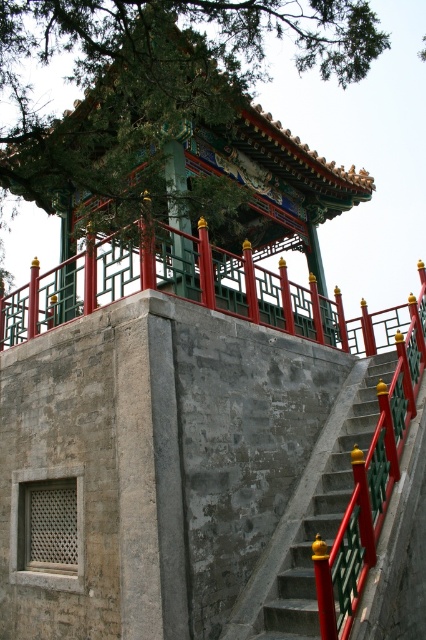
Between point (328, 525) and point (170, 173), which one is positioned in front?

Point (328, 525) is in front.

In the scene shown: Is concrete stairs at center smaller than green painted wood pillar at center?

Actually, concrete stairs at center might be larger than green painted wood pillar at center.

Is point (313, 582) farther from viewer compared to point (169, 177)?

No, (313, 582) is in front of (169, 177).

I want to click on concrete stairs at center, so click(310, 516).

Does green textured tree at upper center appear on the left side of green painted wood pillar at center?

No, green textured tree at upper center is not to the left of green painted wood pillar at center.

Does green textured tree at upper center appear under green painted wood pillar at center?

No.

Who is more distant from viewer, (31, 160) or (183, 285)?

The point (183, 285) is more distant.

Image resolution: width=426 pixels, height=640 pixels. I want to click on green textured tree at upper center, so click(154, 77).

Between green textured tree at upper center and concrete stairs at center, which one has more height?

→ green textured tree at upper center is taller.

Describe the element at coordinates (154, 77) in the screenshot. The image size is (426, 640). I see `green textured tree at upper center` at that location.

Does point (120, 92) come in front of point (359, 390)?

Yes.

The image size is (426, 640). Identify the location of green textured tree at upper center. (154, 77).